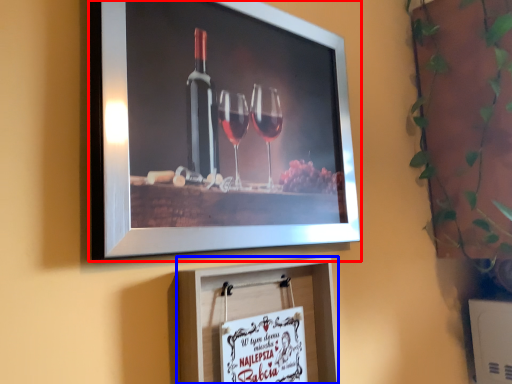
Question: Among these objects, which one is nearest to the camera, picture frame (highlighted by a red box) or picture frame (highlighted by a blue box)?

Choices:
 (A) picture frame
 (B) picture frame

Answer: (A)